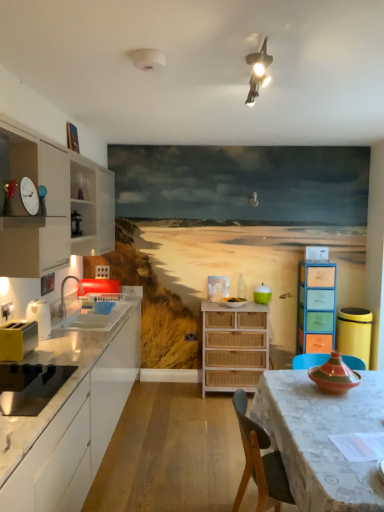
Question: Is patterned fabric table at center positioned with its back to white glossy toaster at left, which is the seventh appliance in right-to-left order?

Choices:
 (A) no
 (B) yes

Answer: (A)

Question: Does patterned fabric table at center appear on the left side of white glossy toaster at left, which ranks as the 3th appliance in front-to-back order?

Choices:
 (A) yes
 (B) no

Answer: (B)

Question: Are patterned fabric table at center and white glossy toaster at left, arranged as the 5th appliance when ordered from the bottom, beside each other?

Choices:
 (A) no
 (B) yes

Answer: (A)

Question: Is patterned fabric table at center bigger than white glossy toaster at left, the third appliance from the top?

Choices:
 (A) no
 (B) yes

Answer: (B)

Question: Is patterned fabric table at center facing towards white glossy toaster at left, the third appliance from the top?

Choices:
 (A) no
 (B) yes

Answer: (B)

Question: From the image's perspective, is patterned fabric table at center above white glossy toaster at left, arranged as the 5th appliance when ordered from the bottom?

Choices:
 (A) no
 (B) yes

Answer: (A)

Question: From a real-world perspective, is multicolored ceramic vase at table, the 6th appliance from the left, over yellow plastic trash can at right, which is counted as the first appliance, starting from the right?

Choices:
 (A) yes
 (B) no

Answer: (A)

Question: Does multicolored ceramic vase at table, which appears as the 6th appliance when viewed from the back, come in front of yellow plastic trash can at right, the 5th appliance when ordered from front to back?

Choices:
 (A) yes
 (B) no

Answer: (A)

Question: From a real-world perspective, is multicolored ceramic vase at table, arranged as the 2th appliance when viewed from the right, physically below yellow plastic trash can at right, the 7th appliance from the top?

Choices:
 (A) yes
 (B) no

Answer: (B)

Question: Could yellow plastic trash can at right, which ranks as the 1th appliance in bottom-to-top order, be considered to be inside multicolored ceramic vase at table, which is the second appliance in front-to-back order?

Choices:
 (A) no
 (B) yes

Answer: (A)

Question: Considering the relative sizes of multicolored ceramic vase at table, arranged as the 2th appliance when viewed from the right, and yellow plastic trash can at right, the 7th appliance from the top, in the image provided, is multicolored ceramic vase at table, arranged as the 2th appliance when viewed from the right, bigger than yellow plastic trash can at right, the 7th appliance from the top,?

Choices:
 (A) no
 (B) yes

Answer: (A)

Question: From the image's perspective, is multicolored ceramic vase at table, the third appliance ordered from the bottom, over yellow plastic trash can at right, the 7th appliance from the top?

Choices:
 (A) no
 (B) yes

Answer: (B)

Question: Does white glossy countertop at left, which ranks as the second cabinetry in top-to-bottom order, appear on the left side of black matte toaster at left, the 6th appliance from the top?

Choices:
 (A) no
 (B) yes

Answer: (B)